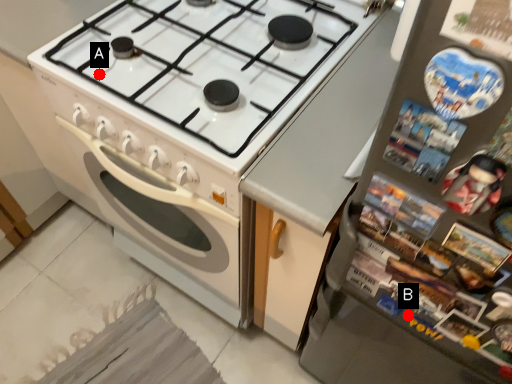
Question: Two points are circled on the image, labeled by A and B beside each circle. Which point is closer to the camera?

Choices:
 (A) A is closer
 (B) B is closer

Answer: (B)